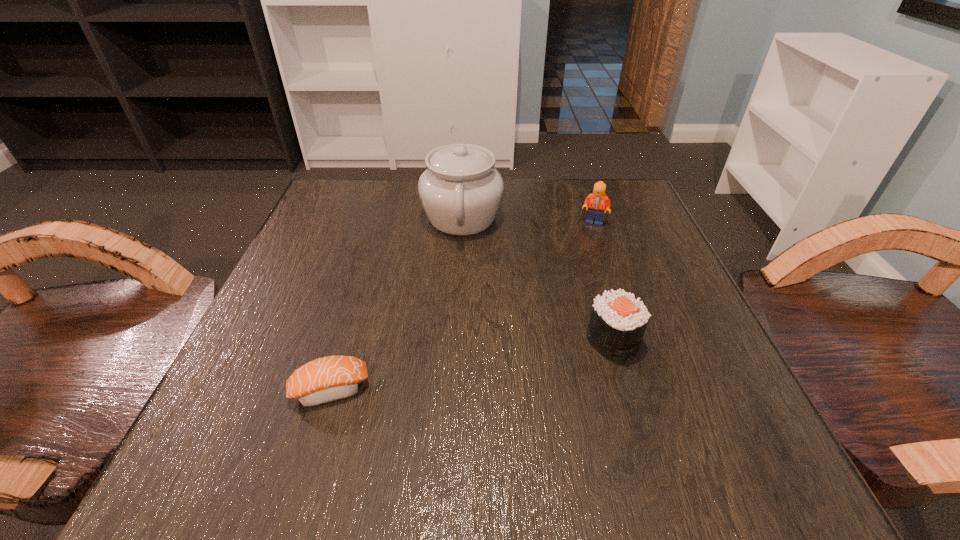
This screenshot has height=540, width=960. I want to click on the second object from left to right, so click(x=461, y=191).

At what (x,y) coordinates should I click in order to perform the action: click on chinaware. Please return your answer as a coordinate pair (x, y). The height and width of the screenshot is (540, 960). Looking at the image, I should click on (461, 191).

Locate an element on the screen. Lego is located at coordinates (597, 201).

Where is `the taller sushi`? the taller sushi is located at coordinates (618, 321).

Identify the location of the right sushi. Image resolution: width=960 pixels, height=540 pixels. [x=618, y=321].

Locate an element on the screen. This screenshot has height=540, width=960. the shortest object is located at coordinates (331, 378).

At what (x,y) coordinates should I click in order to perform the action: click on the nearest object. Please return your answer as a coordinate pair (x, y). The width and height of the screenshot is (960, 540). Looking at the image, I should click on (331, 378).

Find the location of `vacant area situated 0.050m on the right of the second object from left to right`. vacant area situated 0.050m on the right of the second object from left to right is located at coordinates (525, 218).

Where is `vacant position located 0.140m on the front-facing side of the second tallest object`? The image size is (960, 540). vacant position located 0.140m on the front-facing side of the second tallest object is located at coordinates (610, 269).

Where is `vacant region located on the front of the farther sushi`? vacant region located on the front of the farther sushi is located at coordinates (645, 449).